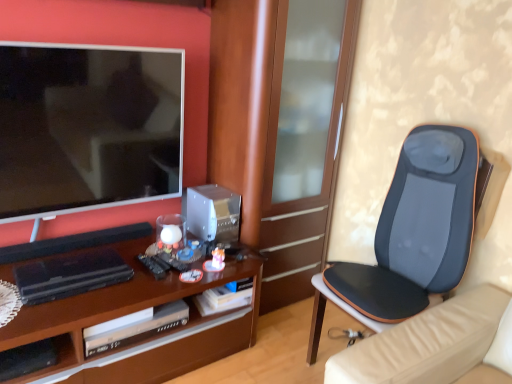
Where is `free space above brown wood desk at center (from a real-world perspective)`? free space above brown wood desk at center (from a real-world perspective) is located at coordinates (130, 266).